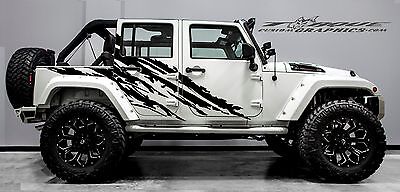
Locate an element on the screen. This screenshot has width=400, height=192. wall is located at coordinates (43, 15), (190, 9), (326, 50), (393, 112), (22, 134).